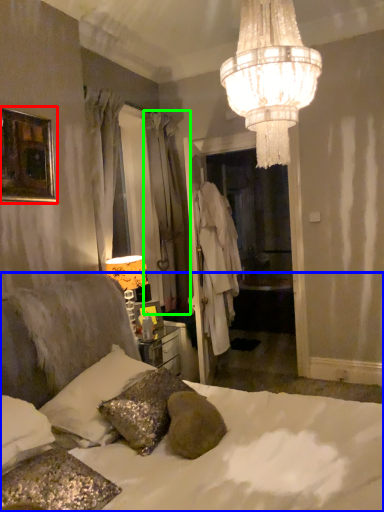
Question: Which is farther away from picture frame (highlighted by a red box)? bed (highlighted by a blue box) or curtain (highlighted by a green box)?

Choices:
 (A) bed
 (B) curtain

Answer: (B)